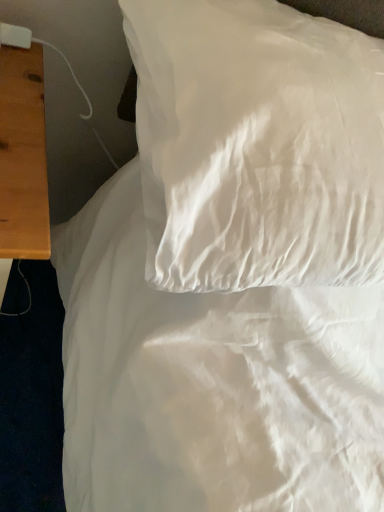
Where is `white satin pillow at upper center`? white satin pillow at upper center is located at coordinates (257, 145).

This screenshot has height=512, width=384. What do you see at coordinates (257, 145) in the screenshot? I see `white satin pillow at upper center` at bounding box center [257, 145].

The image size is (384, 512). Identify the location of white satin pillow at upper center. (257, 145).